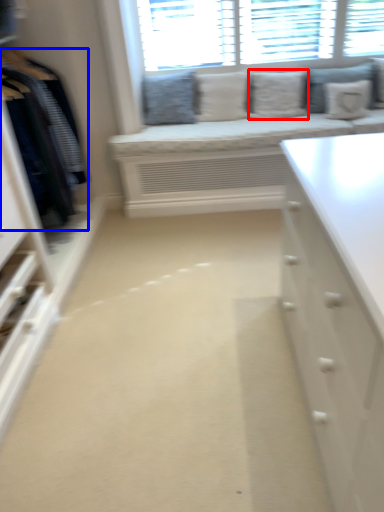
Question: Among these objects, which one is nearest to the camera, pillow (highlighted by a red box) or clothing (highlighted by a blue box)?

Choices:
 (A) pillow
 (B) clothing

Answer: (B)